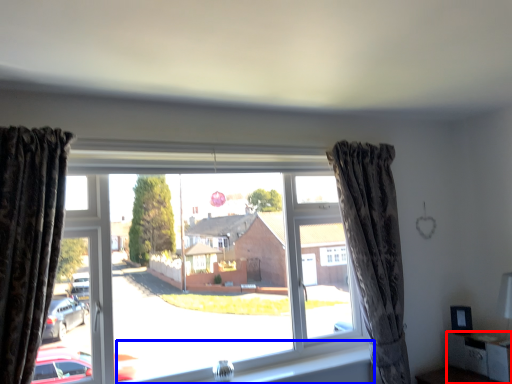
Question: Which of the following is the closest to the observer, furniture (highlighted by a red box) or window sill (highlighted by a blue box)?

Choices:
 (A) furniture
 (B) window sill

Answer: (B)